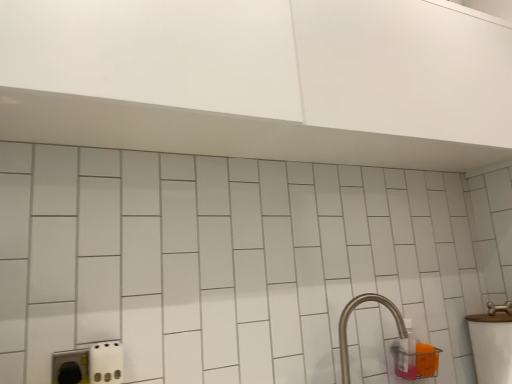
Question: Is translucent plastic bottle at lower right taller or shorter than satin nickel faucet at lower right?

Choices:
 (A) short
 (B) tall

Answer: (A)

Question: In the image, is translucent plastic bottle at lower right on the left side or the right side of satin nickel faucet at lower right?

Choices:
 (A) left
 (B) right

Answer: (B)

Question: Estimate the real-world distances between objects in this image. Which object is farther from the satin nickel faucet at lower right?

Choices:
 (A) white glossy sink at right
 (B) translucent plastic bottle at lower right

Answer: (A)

Question: Which object is positioned farthest from the white glossy sink at right?

Choices:
 (A) satin nickel faucet at lower right
 (B) translucent plastic bottle at lower right

Answer: (A)